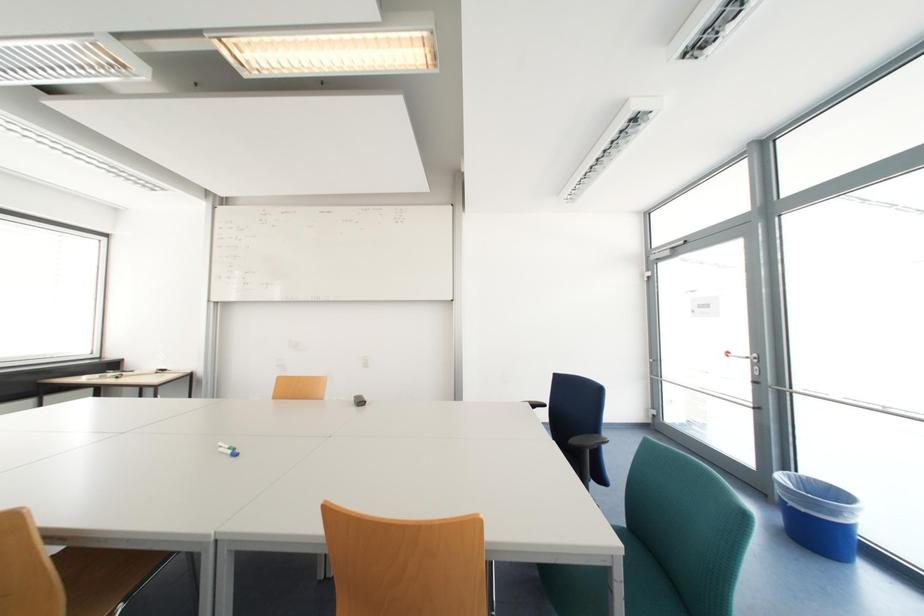
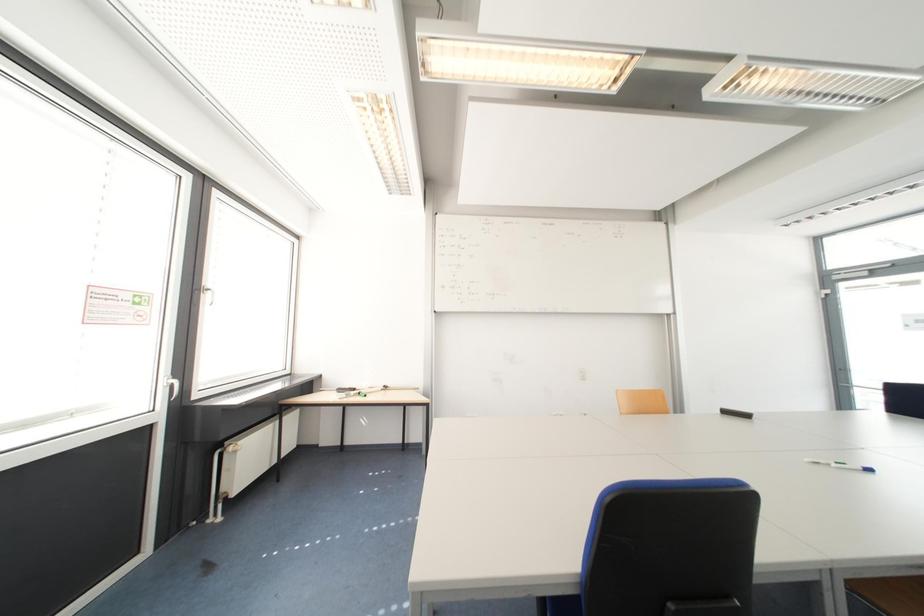
Question: What movement of the cameraman would produce the second image?

Choices:
 (A) Left
 (B) Right
 (C) Forward
 (D) Backward

Answer: (A)